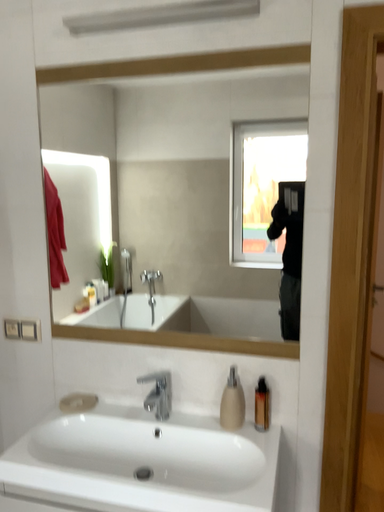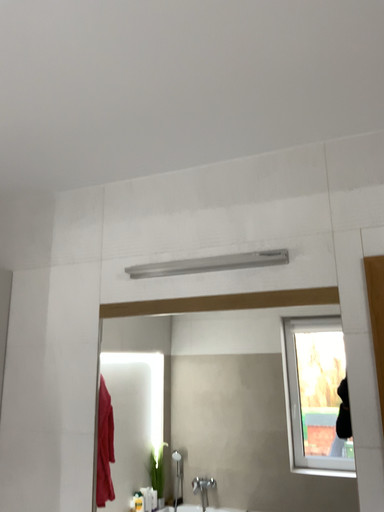
Question: How did the camera likely rotate when shooting the video?

Choices:
 (A) rotated left
 (B) rotated right

Answer: (A)